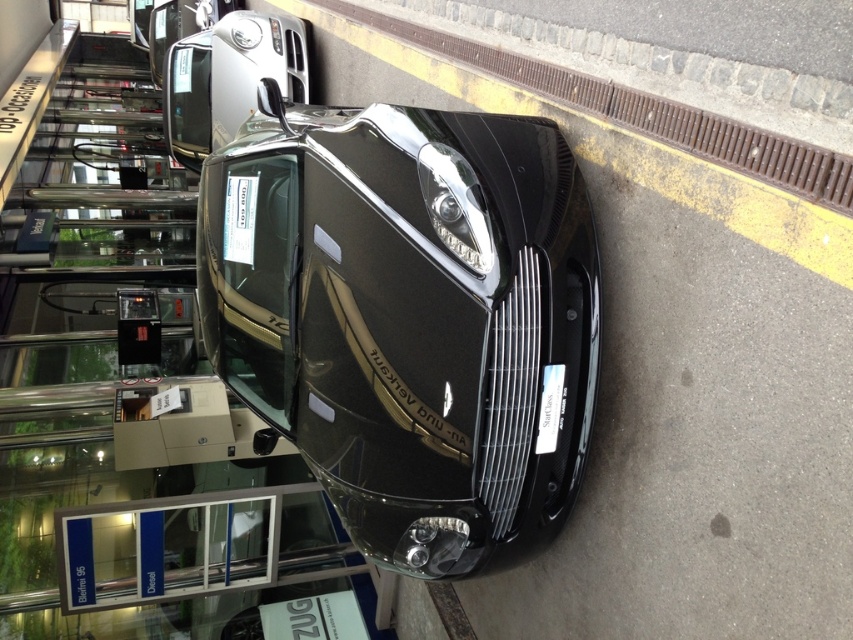
Can you confirm if glossy black car at center is wider than satin silver car at upper center?

Yes, glossy black car at center is wider than satin silver car at upper center.

Between glossy black car at center and satin silver car at upper center, which one appears on the left side from the viewer's perspective?

Positioned to the left is satin silver car at upper center.

Is point (503, 224) positioned behind point (241, 92)?

That is False.

The height and width of the screenshot is (640, 853). I want to click on glossy black car at center, so click(409, 317).